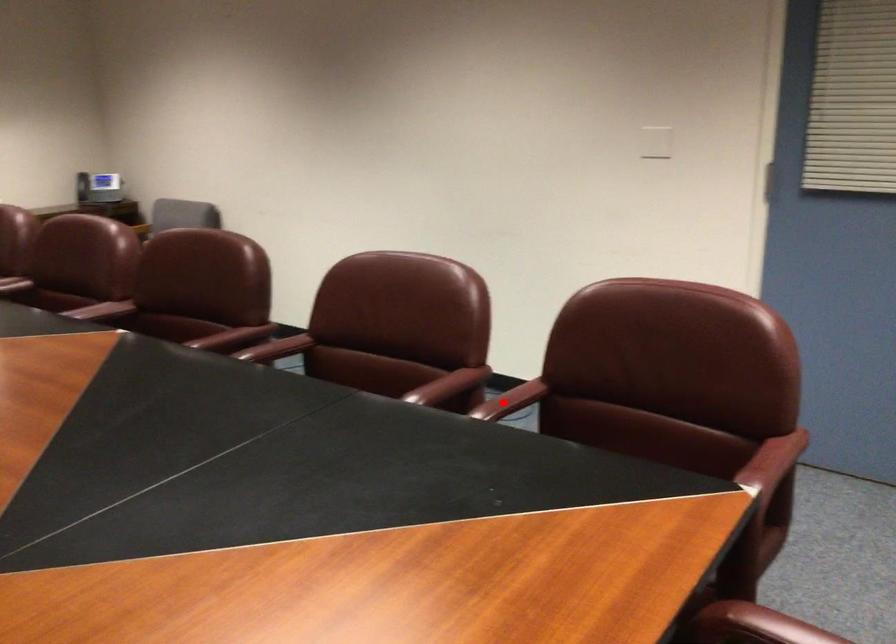
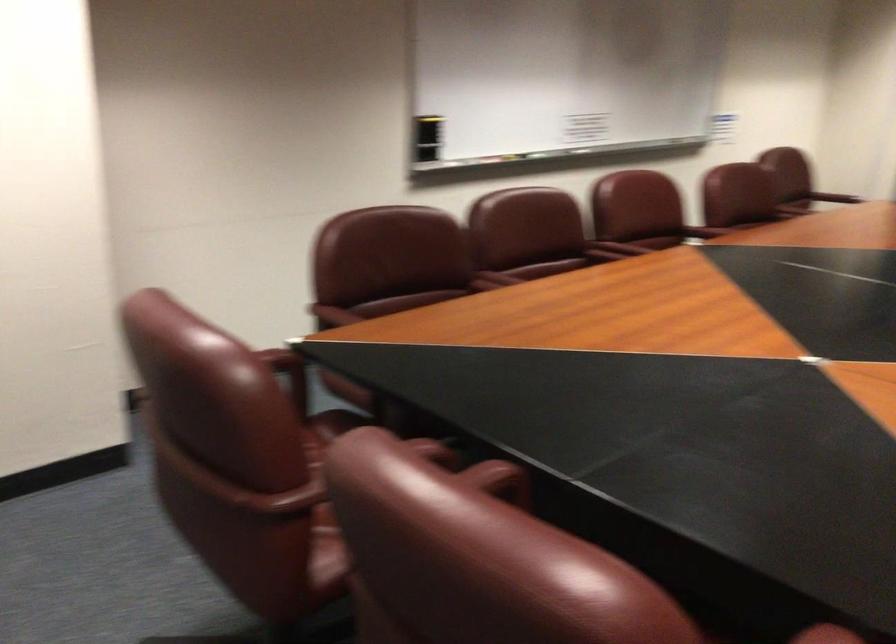
Locate, in the second image, the point that corresponds to the highlighted location in the first image.

(433, 450)